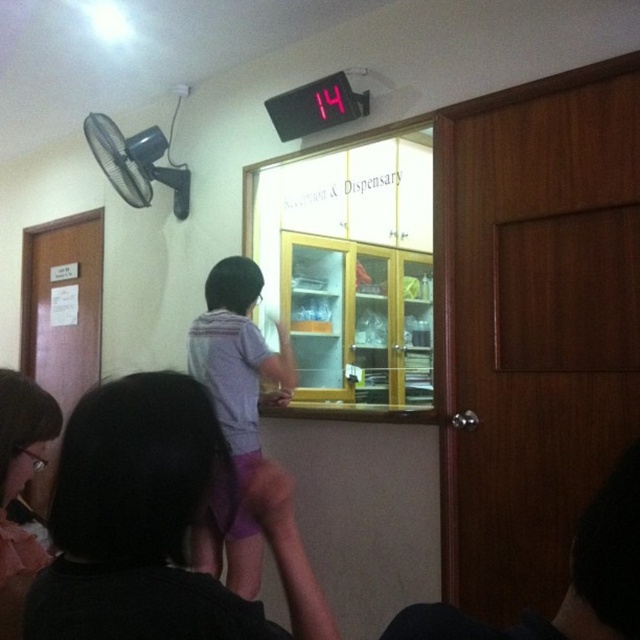
Question: Is purple cotton shorts at center positioned at the back of matte pink fabric at lower left?

Choices:
 (A) yes
 (B) no

Answer: (B)

Question: Among these points, which one is farthest from the camera?

Choices:
 (A) (504, 637)
 (B) (38, 552)

Answer: (B)

Question: Which object appears farthest from the camera in this image?

Choices:
 (A) purple cotton shorts at center
 (B) purple fabric at center
 (C) dark hair at center
 (D) matte pink fabric at lower left

Answer: (D)

Question: Which point is farther from the camera taking this photo?

Choices:
 (A) (252, 419)
 (B) (532, 612)
 (C) (116, 609)

Answer: (A)

Question: Does dark hair at center have a lesser width compared to purple fabric at center?

Choices:
 (A) no
 (B) yes

Answer: (A)

Question: Observing the image, what is the correct spatial positioning of purple cotton shorts at center in reference to matte pink fabric at lower left?

Choices:
 (A) below
 (B) above

Answer: (A)